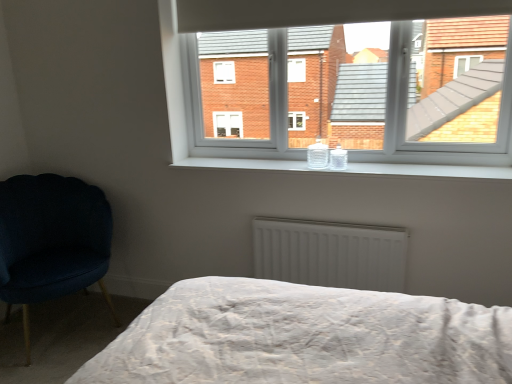
What do you see at coordinates (190, 107) in the screenshot? I see `white plastic window at upper center` at bounding box center [190, 107].

Image resolution: width=512 pixels, height=384 pixels. What do you see at coordinates (51, 241) in the screenshot?
I see `velvet dark blue chair at left` at bounding box center [51, 241].

Locate an element on the screen. The height and width of the screenshot is (384, 512). white plastic window at upper center is located at coordinates (190, 107).

Between velvet dark blue chair at left and white glossy window sill at center, which one is positioned behind?

white glossy window sill at center is further from the camera.

In terms of width, does velvet dark blue chair at left look wider or thinner when compared to white glossy window sill at center?

In the image, velvet dark blue chair at left appears to be wider than white glossy window sill at center.

The height and width of the screenshot is (384, 512). Find the location of `chair below the white glossy window sill at center (from the image's perspective)`. chair below the white glossy window sill at center (from the image's perspective) is located at coordinates (51, 241).

Can you confirm if velvet dark blue chair at left is smaller than white glossy window sill at center?

No.

From a real-world perspective, who is located lower, white glossy window sill at center or white plastic window at upper center?

In real-world perspective, white glossy window sill at center is lower.

Between white glossy window sill at center and white plastic window at upper center, which one has less height?

With less height is white glossy window sill at center.

Based on the photo, from the image's perspective, between white glossy window sill at center and white plastic window at upper center, which one is located above?

white plastic window at upper center.

Considering the positions of objects white glossy window sill at center and white plastic window at upper center in the image provided, who is more to the right, white glossy window sill at center or white plastic window at upper center?

Positioned to the right is white plastic window at upper center.

Is white glossy window sill at center oriented towards white matte radiator at center?

No.

From the image's perspective, which is below, white glossy window sill at center or white matte radiator at center?

white matte radiator at center is shown below in the image.

Identify the location of radiator to the left of white glossy window sill at center. (330, 253).

Considering the positions of points (224, 166) and (357, 279), is point (224, 166) closer to camera compared to point (357, 279)?

That is False.

What's the angular difference between white plastic window at upper center and white glossy window sill at center's facing directions?

white plastic window at upper center and white glossy window sill at center are facing 0.844 degrees away from each other.

Which object is thinner, white plastic window at upper center or white glossy window sill at center?

white plastic window at upper center is thinner.

Considering the relative sizes of white plastic window at upper center and white glossy window sill at center in the image provided, is white plastic window at upper center shorter than white glossy window sill at center?

No.

You are a GUI agent. You are given a task and a screenshot of the screen. Output one action in this format:
    pyautogui.click(x=<x>, y=<y>)
    Task: Click on the window sill to the left of white plastic window at upper center
    
    Given the screenshot: What is the action you would take?
    pyautogui.click(x=349, y=168)

Is white matte radiator at center to the left or to the right of white plastic window at upper center in the image?

Clearly, white matte radiator at center is on the left of white plastic window at upper center in the image.

Consider the image. Is white matte radiator at center bigger or smaller than white plastic window at upper center?

In the image, white matte radiator at center appears to be smaller than white plastic window at upper center.

Is white matte radiator at center not close to white plastic window at upper center?

No, white matte radiator at center is not far away from white plastic window at upper center.

Between velvet dark blue chair at left and white matte radiator at center, which one is positioned behind?

white matte radiator at center.

Which is closer to the camera, [21,196] or [293,261]?

Point [21,196] is farther from the camera than point [293,261].

The width and height of the screenshot is (512, 384). I want to click on radiator behind the velvet dark blue chair at left, so click(330, 253).

Would you say white matte radiator at center is part of velvet dark blue chair at left's contents?

Definitely not — white matte radiator at center is not inside velvet dark blue chair at left.

Between white matte radiator at center and white glossy window sill at center, which one is positioned behind?

white matte radiator at center.

Is the surface of white matte radiator at center in direct contact with white glossy window sill at center?

white matte radiator at center is not next to white glossy window sill at center, and they're not touching.

Find the location of a particular element. Image resolution: width=512 pixels, height=384 pixels. radiator that appears on the left of white glossy window sill at center is located at coordinates pos(330,253).

Considering the positions of point (374, 280) and point (283, 161), is point (374, 280) closer or farther from the camera than point (283, 161)?

Clearly, point (374, 280) is closer to the camera than point (283, 161).

In order to click on chair that appears in front of the white glossy window sill at center in this screenshot , I will do `click(51, 241)`.

Where is `window sill below the white plastic window at upper center (from the image's perspective)`? Image resolution: width=512 pixels, height=384 pixels. window sill below the white plastic window at upper center (from the image's perspective) is located at coordinates (349, 168).

When comparing their distances from white matte radiator at center, does white glossy window sill at center or velvet dark blue chair at left seem closer?

Based on the image, white glossy window sill at center appears to be nearer to white matte radiator at center.

Based on their spatial positions, is white plastic window at upper center or velvet dark blue chair at left further from white matte radiator at center?

velvet dark blue chair at left is further to white matte radiator at center.

Based on their spatial positions, is white plastic window at upper center or white glossy window sill at center closer to velvet dark blue chair at left?

Among the two, white plastic window at upper center is located nearer to velvet dark blue chair at left.

Looking at the image, which one is located further to white matte radiator at center, white glossy window sill at center or white plastic window at upper center?

The object further to white matte radiator at center is white plastic window at upper center.

Which object lies further to the anchor point white plastic window at upper center, white matte radiator at center or white glossy window sill at center?

Based on the image, white matte radiator at center appears to be further to white plastic window at upper center.

Which object lies nearer to the anchor point white glossy window sill at center, velvet dark blue chair at left or white matte radiator at center?

Among the two, white matte radiator at center is located nearer to white glossy window sill at center.

From the image, which object appears to be farther from white matte radiator at center, velvet dark blue chair at left or white plastic window at upper center?

velvet dark blue chair at left.

Which object lies further to the anchor point white glossy window sill at center, white matte radiator at center or white plastic window at upper center?

Among the two, white matte radiator at center is located further to white glossy window sill at center.

What are the coordinates of `radiator situated between velvet dark blue chair at left and white plastic window at upper center from left to right` in the screenshot? It's located at (330, 253).

This screenshot has height=384, width=512. I want to click on window sill between white plastic window at upper center and white matte radiator at center vertically, so click(x=349, y=168).

Identify the location of radiator between velvet dark blue chair at left and white glossy window sill at center from left to right. tap(330, 253).

Identify the location of window sill located between velvet dark blue chair at left and white plastic window at upper center in the left-right direction. The height and width of the screenshot is (384, 512). (349, 168).